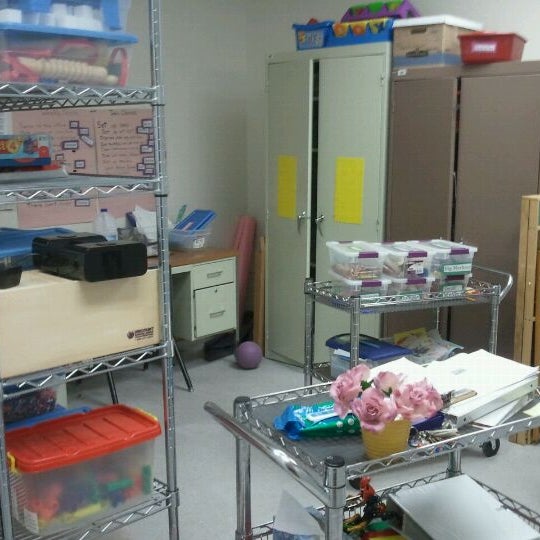
At what (x,y) coordinates should I click in order to perform the action: click on metal handles. Please return your answer as a coordinate pair (x, y). Looking at the image, I should click on (220, 418), (296, 463), (321, 218), (301, 218).